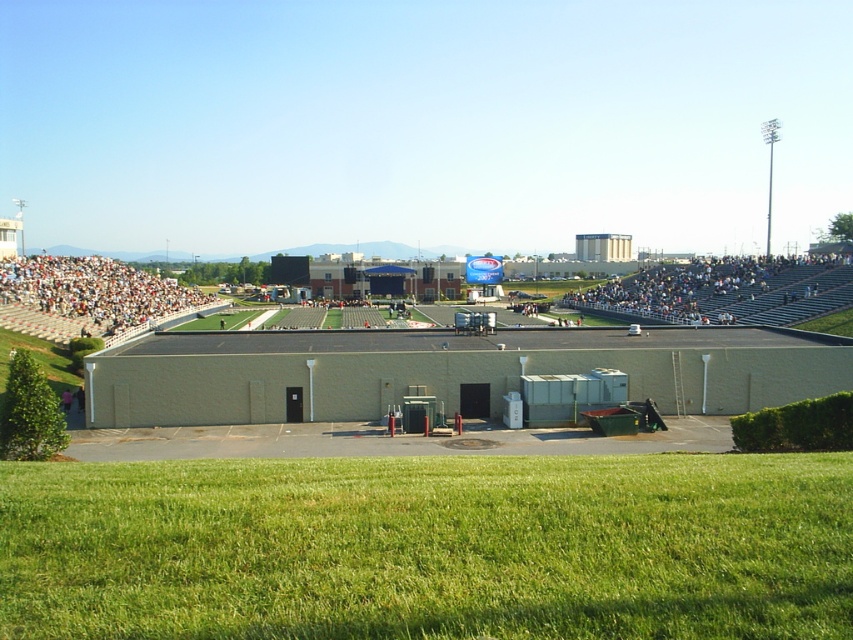
Question: Which point is closer to the camera taking this photo?

Choices:
 (A) (618, 291)
 (B) (10, 490)

Answer: (B)

Question: Which point is closer to the camera?

Choices:
 (A) (33, 554)
 (B) (62, 337)

Answer: (A)

Question: Is green grass at lower center to the right of gray metallic bleachers at right from the viewer's perspective?

Choices:
 (A) yes
 (B) no

Answer: (B)

Question: Is green grass at lower center positioned at the back of gray metallic bleachers at right?

Choices:
 (A) yes
 (B) no

Answer: (B)

Question: Can you confirm if green grass at lower center is thinner than gray metallic bleachers at right?

Choices:
 (A) yes
 (B) no

Answer: (A)

Question: Which object is closer to the camera taking this photo?

Choices:
 (A) white plastic seats at left
 (B) gray metallic bleachers at right

Answer: (A)